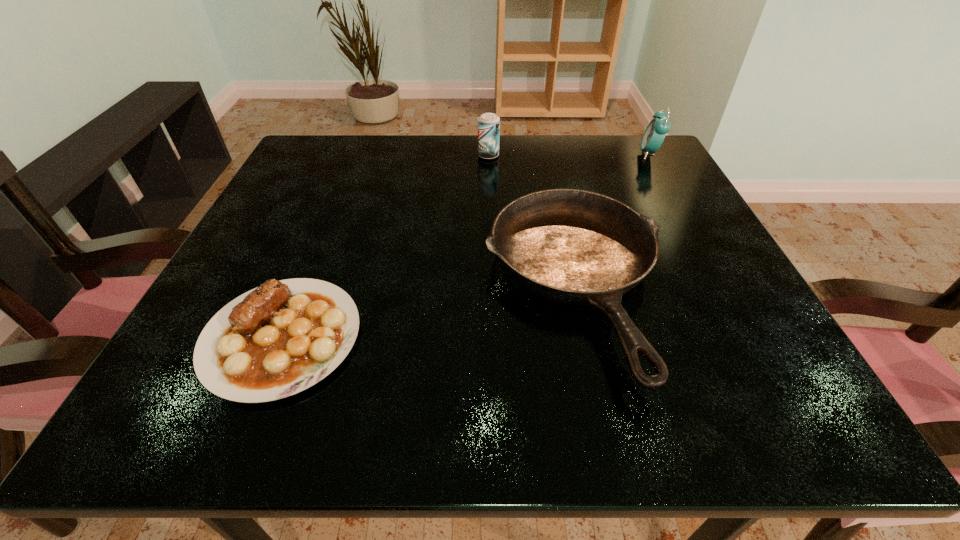
Find the location of a particular element. The image size is (960, 540). free location that satisfies the following two spatial constraints: 1. on the back side of the frying pan; 2. on the left side of the steak is located at coordinates (302, 287).